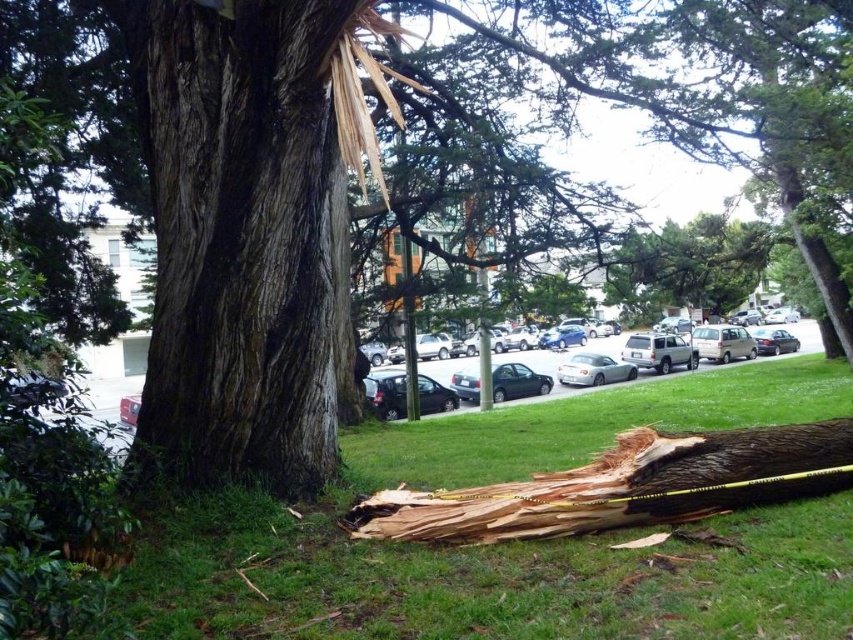
Which is behind, point (682, 337) or point (576, 364)?

The point (682, 337) is more distant.

Can you confirm if silver metallic sedan at center is positioned below satin silver car at center?

Result: Incorrect, silver metallic sedan at center is not positioned below satin silver car at center.

Between point (582, 392) and point (578, 368), which one is positioned in front?

Positioned in front is point (582, 392).

Locate an element on the screen. silver metallic sedan at center is located at coordinates (566, 360).

Does dark brown rough bark tree trunk at center have a larger size compared to silver metallic sedan at center?

No, dark brown rough bark tree trunk at center is not bigger than silver metallic sedan at center.

Which is more to the right, dark brown rough bark tree trunk at center or silver metallic sedan at center?

silver metallic sedan at center is more to the right.

Between point (271, 488) and point (525, 356), which one is positioned in front?

Positioned in front is point (271, 488).

Identify the location of dark brown rough bark tree trunk at center. (239, 243).

Who is shorter, dark brown rough bark tree trunk at center or metallic dark green sedan at center?

Standing shorter between the two is metallic dark green sedan at center.

Which is above, dark brown rough bark tree trunk at center or metallic dark green sedan at center?

Positioned higher is dark brown rough bark tree trunk at center.

The height and width of the screenshot is (640, 853). In order to click on dark brown rough bark tree trunk at center in this screenshot , I will do `click(239, 243)`.

At what (x,y) coordinates should I click in order to perform the action: click on dark brown rough bark tree trunk at center. Please return your answer as a coordinate pair (x, y). This screenshot has width=853, height=640. Looking at the image, I should click on (239, 243).